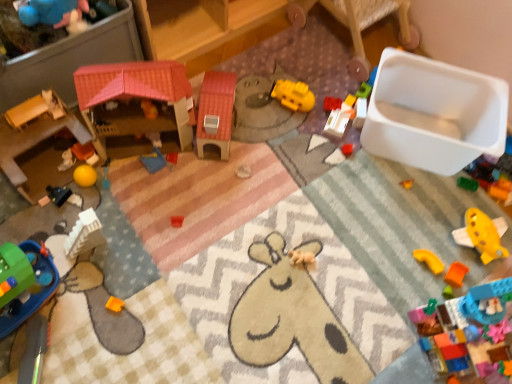
The width and height of the screenshot is (512, 384). Find the location of `vacant area that lies between yellow matte plastic arch at lower right, acting as the 4th toy starting from the right, and translucent blue plastic blocks at lower right, the third toy viewed from the right`. vacant area that lies between yellow matte plastic arch at lower right, acting as the 4th toy starting from the right, and translucent blue plastic blocks at lower right, the third toy viewed from the right is located at coordinates (426, 286).